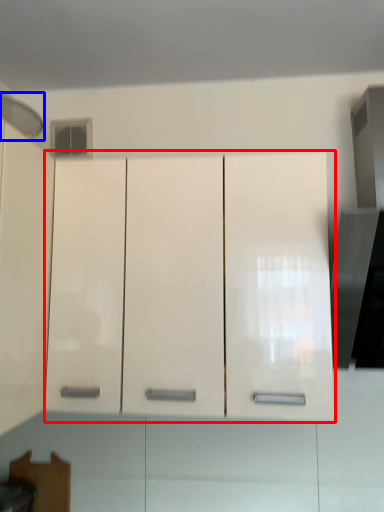
Question: Among these objects, which one is nearest to the camera, cabinetry (highlighted by a red box) or exhaust hood (highlighted by a blue box)?

Choices:
 (A) cabinetry
 (B) exhaust hood

Answer: (B)